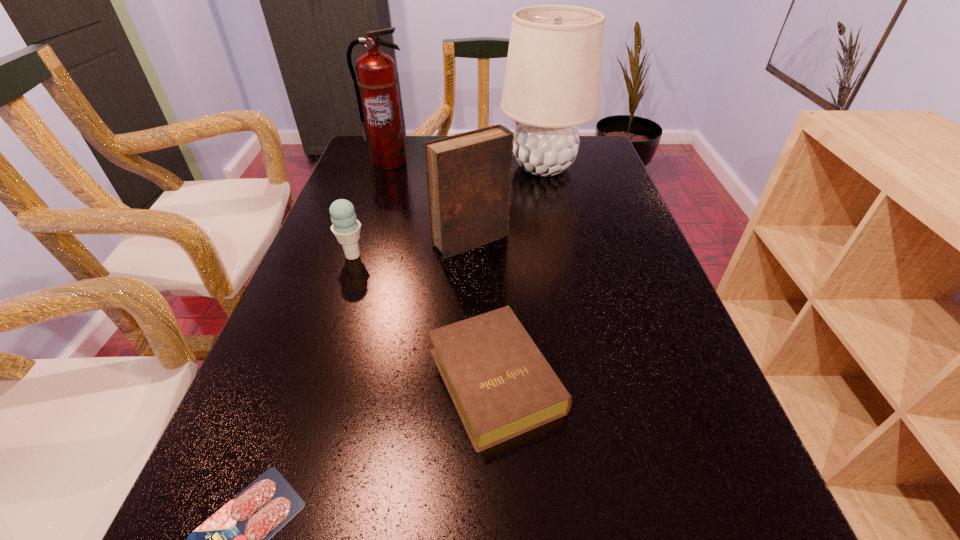
Identify the location of blank area located 0.140m on the back of the fourth tallest object. (367, 214).

Locate an element on the screen. Image resolution: width=960 pixels, height=540 pixels. vacant space located 0.060m on the left of the nearer Bible is located at coordinates (394, 380).

Identify the location of lampshade at the far edge. pos(552,80).

What are the coordinates of `fire extinguisher at the far edge` in the screenshot? It's located at (376, 88).

Locate an element on the screen. fire extinguisher that is at the left edge is located at coordinates (376, 88).

The width and height of the screenshot is (960, 540). Find the location of `ice cream located in the left edge section of the desktop`. ice cream located in the left edge section of the desktop is located at coordinates (346, 228).

You are a GUI agent. You are given a task and a screenshot of the screen. Output one action in this format:
    pyautogui.click(x=<x>, y=<y>)
    Task: Click on the object at the right edge
    The image size is (960, 540).
    Given the screenshot: What is the action you would take?
    click(552, 80)

This screenshot has width=960, height=540. I want to click on object positioned at the far left corner, so click(376, 88).

Identify the location of object that is at the far right corner. (552, 80).

Find the location of `free region at the left edge`. free region at the left edge is located at coordinates (349, 193).